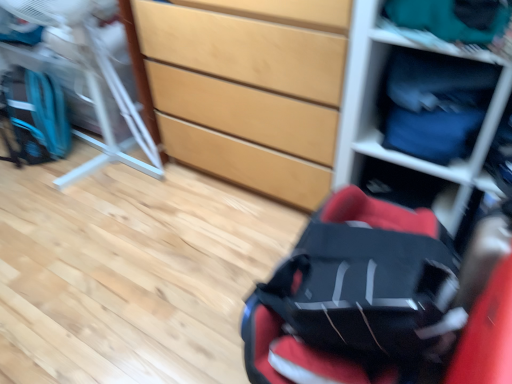
Question: From their relative heights in the image, would you say teal fabric at upper right is taller or shorter than metallic silver folding chair at left?

Choices:
 (A) short
 (B) tall

Answer: (A)

Question: Based on their sizes in the image, would you say teal fabric at upper right is bigger or smaller than metallic silver folding chair at left?

Choices:
 (A) big
 (B) small

Answer: (B)

Question: Which of these objects is positioned closest to the matte plastic shelf at upper right?

Choices:
 (A) teal fabric at upper right
 (B) red fabric baby carriage at center
 (C) metallic silver folding chair at left
 (D) blue fabric drawer at upper right
 (E) matte wood chest of drawers at center

Answer: (D)

Question: Estimate the real-world distances between objects in this image. Which object is farther from the matte plastic shelf at upper right?

Choices:
 (A) metallic silver folding chair at left
 (B) red fabric baby carriage at center
 (C) matte wood chest of drawers at center
 (D) teal fabric at upper right
 (E) blue fabric drawer at upper right

Answer: (A)